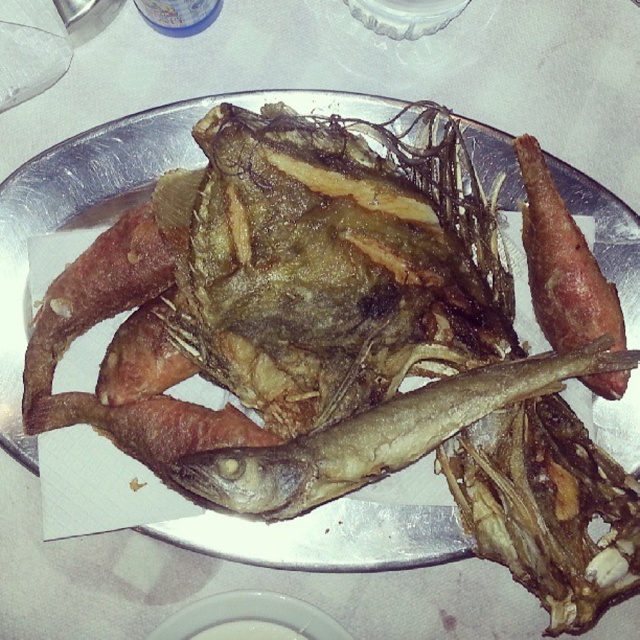
Question: Which point is closer to the camera taking this photo?

Choices:
 (A) (268, 634)
 (B) (346, 483)
 (C) (544, 179)

Answer: (B)

Question: Is brown crispy fish at center closer to camera compared to brown crispy bacon at right?

Choices:
 (A) no
 (B) yes

Answer: (B)

Question: Estimate the real-world distances between objects in this image. Which object is farther from the brown crispy bacon at right?

Choices:
 (A) white glossy plate at center
 (B) brown crispy fish at center

Answer: (A)

Question: Which object is farther from the camera taking this photo?

Choices:
 (A) white glossy plate at center
 (B) brown crispy bacon at right

Answer: (A)

Question: From the image, what is the correct spatial relationship of brown crispy fish at center in relation to brown crispy bacon at right?

Choices:
 (A) above
 (B) below

Answer: (B)

Question: Where is brown crispy bacon at right located in relation to white glossy plate at center in the image?

Choices:
 (A) below
 (B) above

Answer: (B)